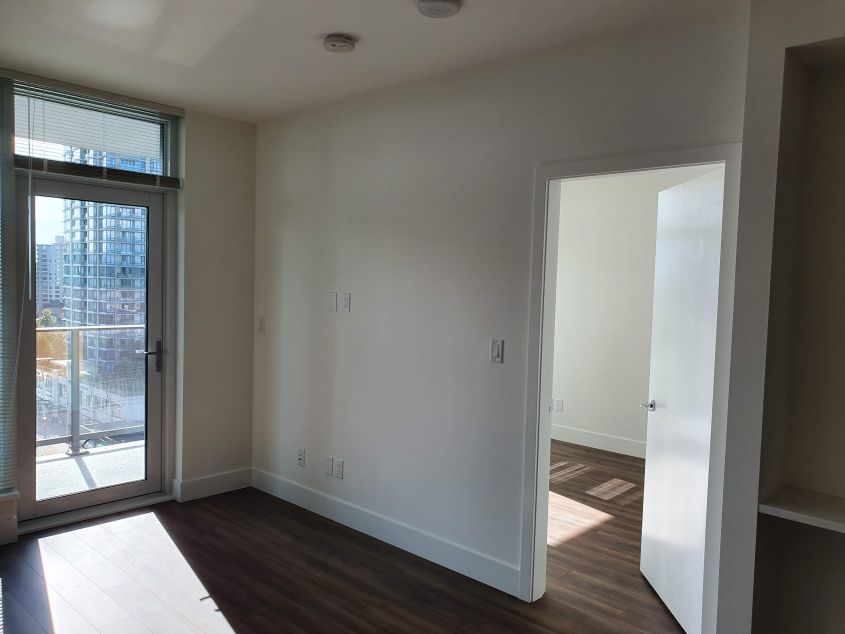
The image size is (845, 634). I want to click on fire alarms, so click(x=333, y=44), click(x=440, y=6).